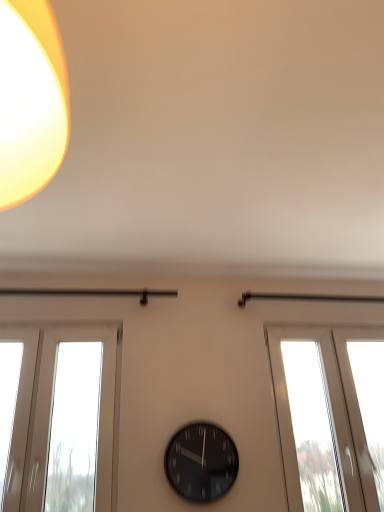
Question: Is white glossy window at right to the right of black glass clock at center from the viewer's perspective?

Choices:
 (A) no
 (B) yes

Answer: (B)

Question: Is white glossy window at right bigger than black glass clock at center?

Choices:
 (A) yes
 (B) no

Answer: (A)

Question: Can you confirm if white glossy window at right is taller than black glass clock at center?

Choices:
 (A) yes
 (B) no

Answer: (A)

Question: Does white glossy window at right turn towards black glass clock at center?

Choices:
 (A) no
 (B) yes

Answer: (A)

Question: Is white glossy window at right positioned before black glass clock at center?

Choices:
 (A) no
 (B) yes

Answer: (A)

Question: Considering the relative sizes of white glossy window at right and black glass clock at center in the image provided, is white glossy window at right smaller than black glass clock at center?

Choices:
 (A) no
 (B) yes

Answer: (A)

Question: Does black glass clock at center come in front of white glossy window at right?

Choices:
 (A) no
 (B) yes

Answer: (B)

Question: Is black glass clock at center turned away from white glossy window at right?

Choices:
 (A) yes
 (B) no

Answer: (B)

Question: Is black glass clock at center positioned beyond the bounds of white glossy window at right?

Choices:
 (A) no
 (B) yes

Answer: (B)

Question: Does black glass clock at center turn towards white glossy window at right?

Choices:
 (A) yes
 (B) no

Answer: (B)

Question: Is black glass clock at center not near white glossy window at right?

Choices:
 (A) no
 (B) yes

Answer: (A)

Question: From a real-world perspective, is black glass clock at center positioned over white glossy window at right based on gravity?

Choices:
 (A) no
 (B) yes

Answer: (A)

Question: From the image's perspective, is black glass clock at center positioned above or below white glossy window at right?

Choices:
 (A) above
 (B) below

Answer: (B)